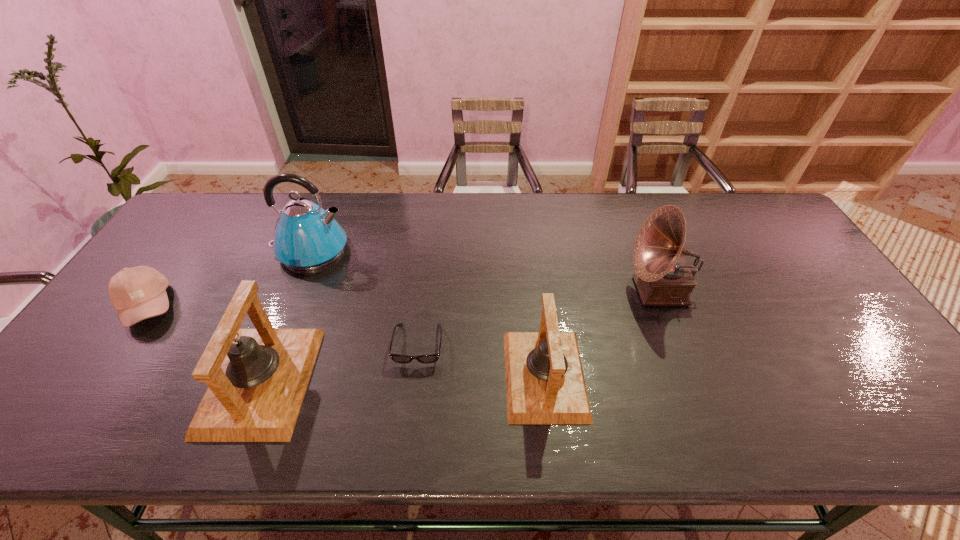
Find the location of `object at the left edge`. object at the left edge is located at coordinates tap(137, 293).

This screenshot has width=960, height=540. In order to click on vacant space at the far edge of the desktop in this screenshot , I will do `click(502, 205)`.

This screenshot has width=960, height=540. In the image, there is a desktop. Find the location of `free space at the near edge`. free space at the near edge is located at coordinates (639, 396).

What are the coordinates of `blank space at the left edge` in the screenshot? It's located at (185, 242).

In the image, there is a desktop. Where is `vacant area at the right edge`? The width and height of the screenshot is (960, 540). vacant area at the right edge is located at coordinates coord(822,284).

Where is `free space at the near left corner of the desktop`? The width and height of the screenshot is (960, 540). free space at the near left corner of the desktop is located at coordinates (89, 386).

At what (x,y) coordinates should I click in order to perform the action: click on free point at the far right corner. Please return your answer as a coordinate pair (x, y). Looking at the image, I should click on (732, 202).

Image resolution: width=960 pixels, height=540 pixels. I want to click on vacant space at the near right corner of the desktop, so click(x=864, y=374).

Where is `vacant space in between the phonograph record and the baseball cap`? Image resolution: width=960 pixels, height=540 pixels. vacant space in between the phonograph record and the baseball cap is located at coordinates coord(403,299).

This screenshot has width=960, height=540. Identify the location of free space that is in between the taller bell and the fourth tallest object. (403, 378).